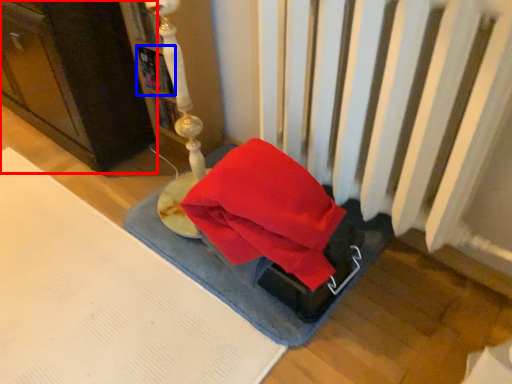
Question: Which of the following is the farthest to the observer, furniture (highlighted by a red box) or book (highlighted by a blue box)?

Choices:
 (A) furniture
 (B) book

Answer: (B)